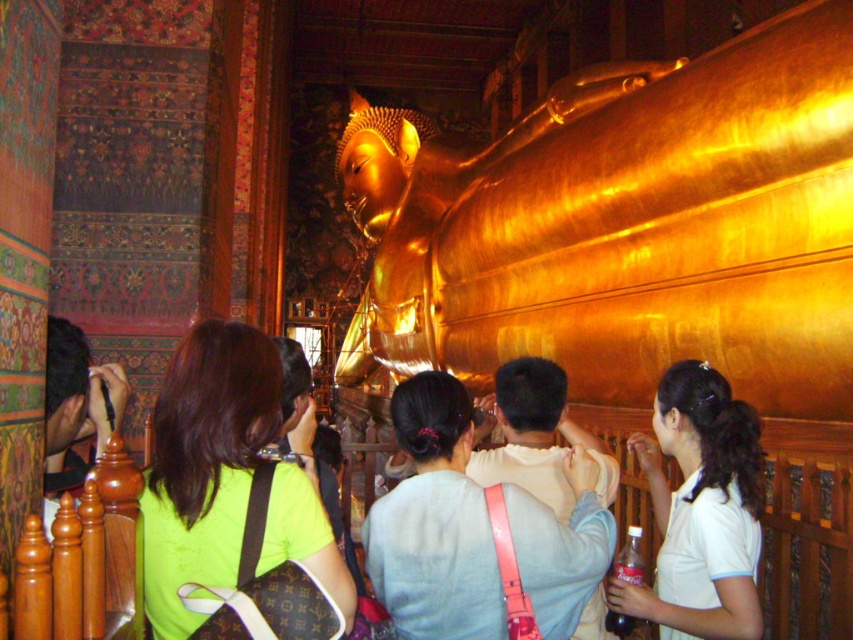
In order to click on light blue fabric shirt at center in this screenshot , I will do `click(434, 524)`.

Is light blue fabric shirt at center above dark brown hair at left?

No, light blue fabric shirt at center is not above dark brown hair at left.

Who is more distant from viewer, [503,486] or [83,364]?

Positioned behind is point [83,364].

Locate an element on the screen. light blue fabric shirt at center is located at coordinates (434, 524).

Does white matte shirt at center appear over dark brown hair at left?

No.

The image size is (853, 640). What do you see at coordinates (700, 509) in the screenshot?
I see `white matte shirt at center` at bounding box center [700, 509].

The height and width of the screenshot is (640, 853). What do you see at coordinates (700, 509) in the screenshot?
I see `white matte shirt at center` at bounding box center [700, 509].

Where is `white matte shirt at center`? The image size is (853, 640). white matte shirt at center is located at coordinates (700, 509).

Who is more distant from viewer, (225, 324) or (663, 412)?

The point (663, 412) is behind.

Measure the distance between green fabric bag at center and camera.

They are 70.25 feet apart.

Who is more forward, (144, 593) or (759, 506)?

Positioned in front is point (144, 593).

Identify the location of green fabric bag at center. The height and width of the screenshot is (640, 853). (204, 465).